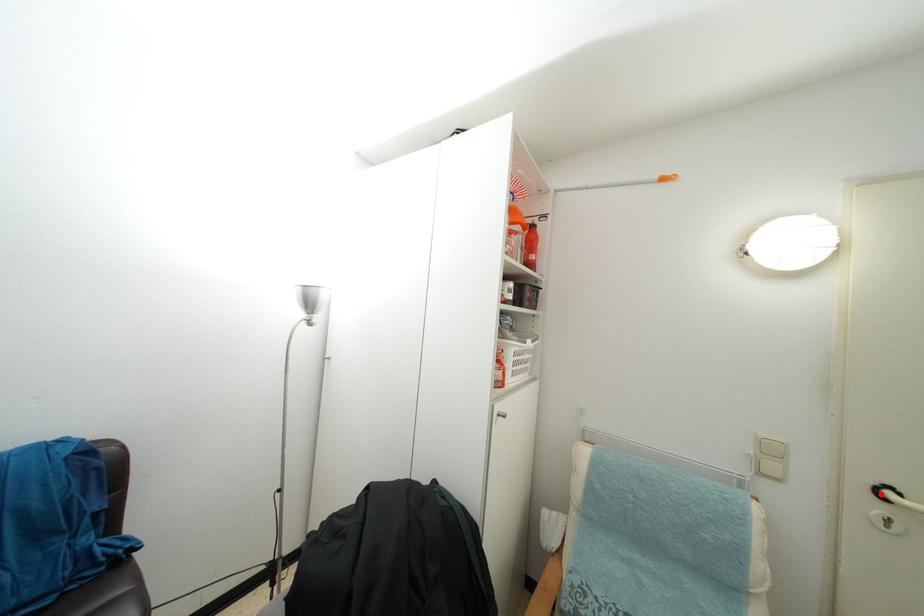
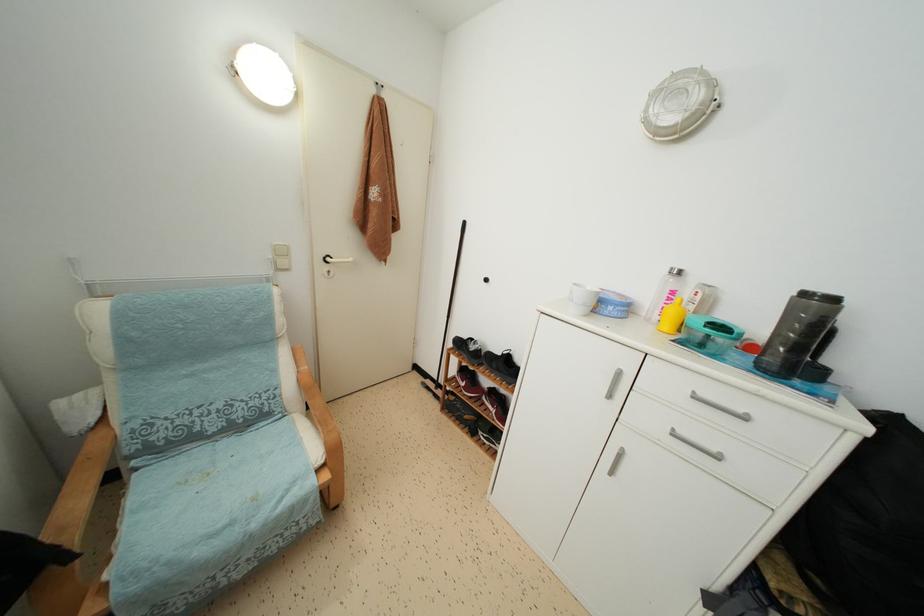
Where in the second image is the point corresponding to the highlighted location from the first image?

(329, 264)